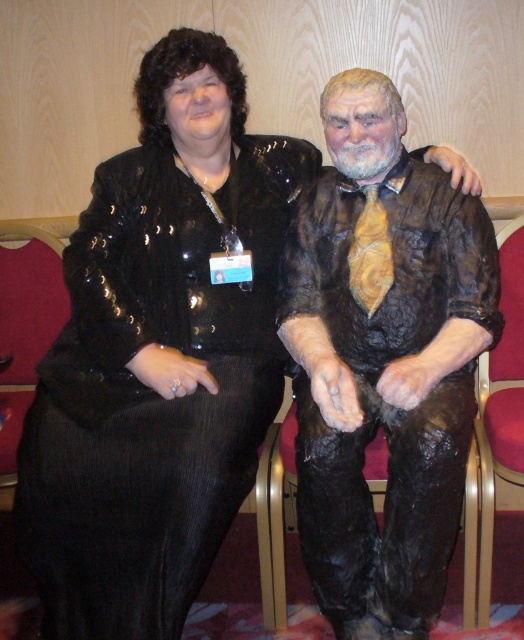
Can you confirm if black sequined dress at center is thinner than brown textured statue at center?

In fact, black sequined dress at center might be wider than brown textured statue at center.

Can you confirm if black sequined dress at center is wider than brown textured statue at center?

Indeed, black sequined dress at center has a greater width compared to brown textured statue at center.

Who is more distant from viewer, (266, 323) or (332, 476)?

The point (266, 323) is more distant.

Locate an element on the screen. The width and height of the screenshot is (524, 640). black sequined dress at center is located at coordinates (152, 392).

Does black sequined dress at center appear under metallic gold armchair at right?

Incorrect, black sequined dress at center is not positioned below metallic gold armchair at right.

Who is positioned more to the right, black sequined dress at center or metallic gold armchair at right?

From the viewer's perspective, metallic gold armchair at right appears more on the right side.

Is point (174, 340) closer to camera compared to point (505, 269)?

Yes, it is in front of point (505, 269).

Where is `black sequined dress at center`? black sequined dress at center is located at coordinates (152, 392).

Does brown textured statue at center appear on the left side of metallic gold armchair at right?

Yes, brown textured statue at center is to the left of metallic gold armchair at right.

Between brown textured statue at center and metallic gold armchair at right, which one appears on the left side from the viewer's perspective?

brown textured statue at center

Is point (335, 525) closer to viewer compared to point (484, 387)?

Yes, point (335, 525) is closer to viewer.

Locate an element on the screen. brown textured statue at center is located at coordinates (383, 362).